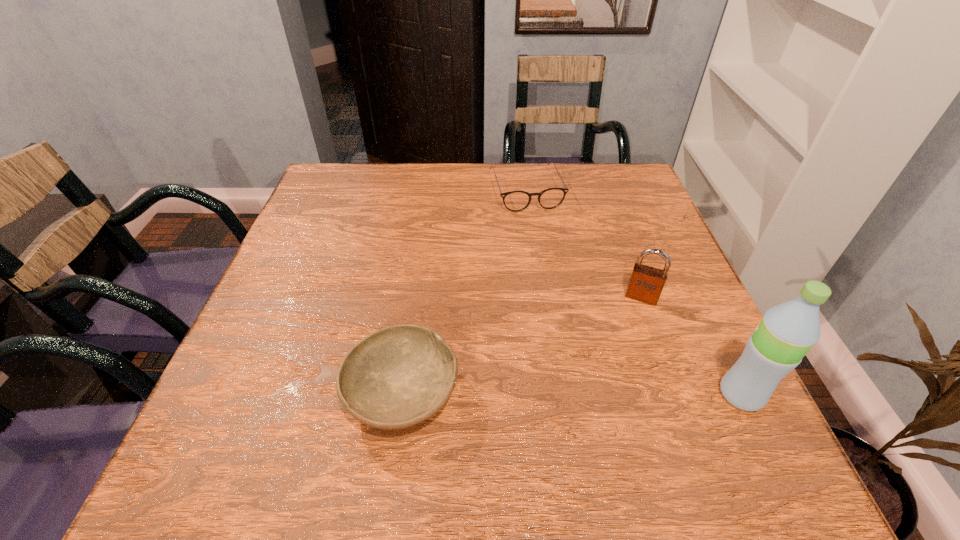
You are a GUI agent. You are given a task and a screenshot of the screen. Output one action in this format:
    pyautogui.click(x=<x>, y=<y>)
    Task: Click on the empty space between the bowl and the tallest object
    Image resolution: width=960 pixels, height=540 pixels.
    Given the screenshot: What is the action you would take?
    pyautogui.click(x=572, y=394)

You are a GUI agent. You are given a task and a screenshot of the screen. Output one action in this format:
    pyautogui.click(x=<x>, y=<y>)
    Task: Click on the empty space between the leftmost object and the second object from right to left
    The image size is (960, 540).
    Given the screenshot: What is the action you would take?
    pyautogui.click(x=522, y=346)

The height and width of the screenshot is (540, 960). What are the coordinates of `free spot between the third tallest object and the rightmost object` in the screenshot? It's located at (572, 394).

The width and height of the screenshot is (960, 540). I want to click on free space that is in between the padlock and the shortest object, so click(584, 244).

Find the location of `vacant point located between the padlock and the farthest object`. vacant point located between the padlock and the farthest object is located at coordinates (584, 244).

Where is `vacant area that lies between the tallest object and the second farthest object`? The width and height of the screenshot is (960, 540). vacant area that lies between the tallest object and the second farthest object is located at coordinates (691, 346).

Where is `object that is the third closest to the padlock`? object that is the third closest to the padlock is located at coordinates (397, 377).

Choose which object is the second nearest neighbor to the tallest object. Please provide its 2D coordinates. Your answer should be formatted as a tuple, i.e. [(x, y)], where the tuple contains the x and y coordinates of a point satisfying the conditions above.

[(397, 377)]

Where is `free space that satisfies the following two spatial constraints: 1. on the back side of the leftmost object; 2. on the left side of the padlock`? This screenshot has height=540, width=960. free space that satisfies the following two spatial constraints: 1. on the back side of the leftmost object; 2. on the left side of the padlock is located at coordinates (417, 297).

I want to click on free location that satisfies the following two spatial constraints: 1. on the front side of the tallest object; 2. on the left side of the second object from left to right, so click(x=553, y=394).